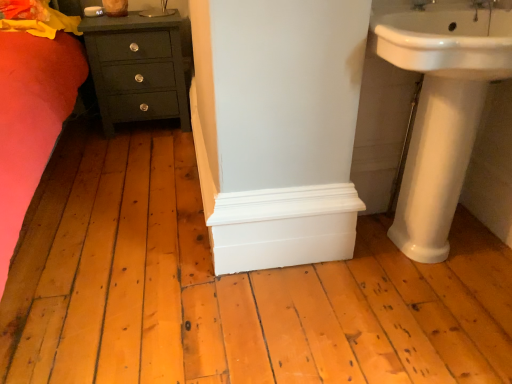
Question: Is white glossy sink at upper right, which ranks as the 2th sink in bottom-to-top order, taller than matte dark green chest of drawers at lower left?

Choices:
 (A) yes
 (B) no

Answer: (B)

Question: From a real-world perspective, is white glossy sink at upper right, which ranks as the first sink in top-to-bottom order, on top of matte dark green chest of drawers at lower left?

Choices:
 (A) no
 (B) yes

Answer: (B)

Question: Is white glossy sink at upper right, which ranks as the 2th sink in bottom-to-top order, smaller than matte dark green chest of drawers at lower left?

Choices:
 (A) yes
 (B) no

Answer: (A)

Question: Is the depth of white glossy sink at upper right, which ranks as the first sink in top-to-bottom order, greater than that of matte dark green chest of drawers at lower left?

Choices:
 (A) yes
 (B) no

Answer: (B)

Question: From the image's perspective, is white glossy sink at upper right, which ranks as the first sink in top-to-bottom order, on matte dark green chest of drawers at lower left?

Choices:
 (A) no
 (B) yes

Answer: (A)

Question: From a real-world perspective, is white ceramic tap at upper right physically located above or below matte dark green chest of drawers at lower left?

Choices:
 (A) above
 (B) below

Answer: (A)

Question: Is white ceramic tap at upper right bigger or smaller than matte dark green chest of drawers at lower left?

Choices:
 (A) big
 (B) small

Answer: (B)

Question: Relative to matte dark green chest of drawers at lower left, is white ceramic tap at upper right in front or behind?

Choices:
 (A) front
 (B) behind

Answer: (A)

Question: Is point (415, 3) positioned closer to the camera than point (164, 18)?

Choices:
 (A) farther
 (B) closer

Answer: (B)

Question: Looking at the image, does white ceramic tap at upper right seem bigger or smaller compared to white glossy pedestal sink at right, which is the second sink in top-to-bottom order?

Choices:
 (A) small
 (B) big

Answer: (A)

Question: Would you say white ceramic tap at upper right is inside or outside white glossy pedestal sink at right, which is the second sink in top-to-bottom order?

Choices:
 (A) inside
 (B) outside

Answer: (B)

Question: From the image's perspective, is white ceramic tap at upper right located above or below white glossy pedestal sink at right, which is the second sink in top-to-bottom order?

Choices:
 (A) above
 (B) below

Answer: (A)

Question: Does point (424, 3) appear closer or farther from the camera than point (412, 155)?

Choices:
 (A) closer
 (B) farther

Answer: (A)

Question: Based on their sizes in the image, would you say matte dark green chest of drawers at lower left is bigger or smaller than white glossy pedestal sink at right, which ranks as the first sink in bottom-to-top order?

Choices:
 (A) big
 (B) small

Answer: (A)

Question: In terms of height, does matte dark green chest of drawers at lower left look taller or shorter compared to white glossy pedestal sink at right, which ranks as the first sink in bottom-to-top order?

Choices:
 (A) tall
 (B) short

Answer: (B)